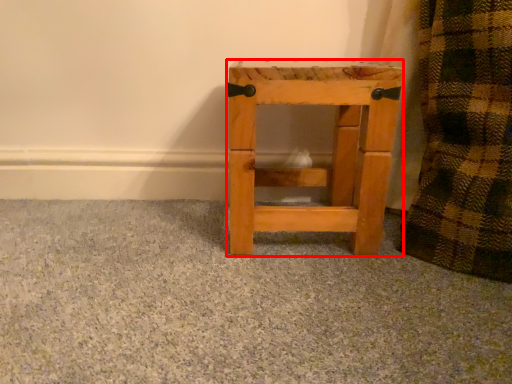
Question: In this image, where is furniture (annotated by the red box) located relative to concrete?

Choices:
 (A) left
 (B) right

Answer: (B)